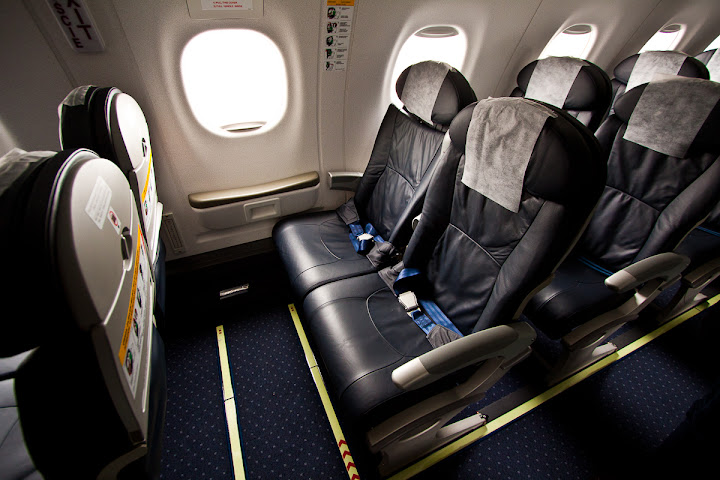
Where is `windows`? Image resolution: width=720 pixels, height=480 pixels. windows is located at coordinates (229, 72), (451, 50), (584, 49), (664, 42), (711, 42).